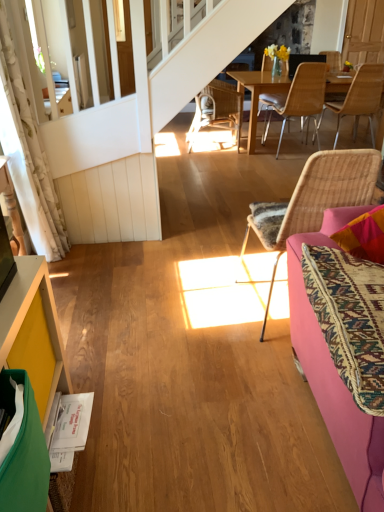
Find the location of `free space to the right of yellow painted wood cabinet at lower left`. free space to the right of yellow painted wood cabinet at lower left is located at coordinates (137, 462).